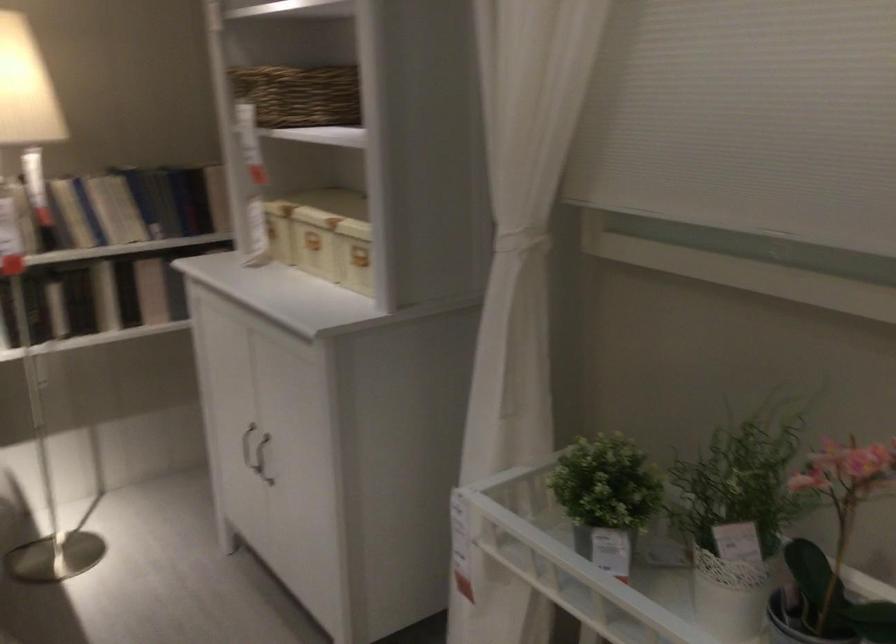
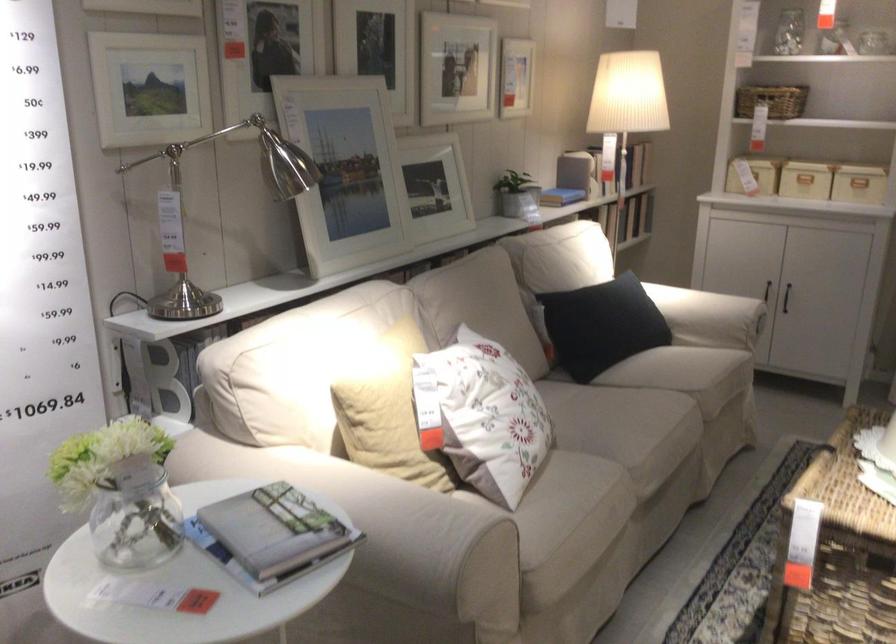
Where in the second image is the point corresponding to (x=187, y=266) from the first image?

(753, 175)